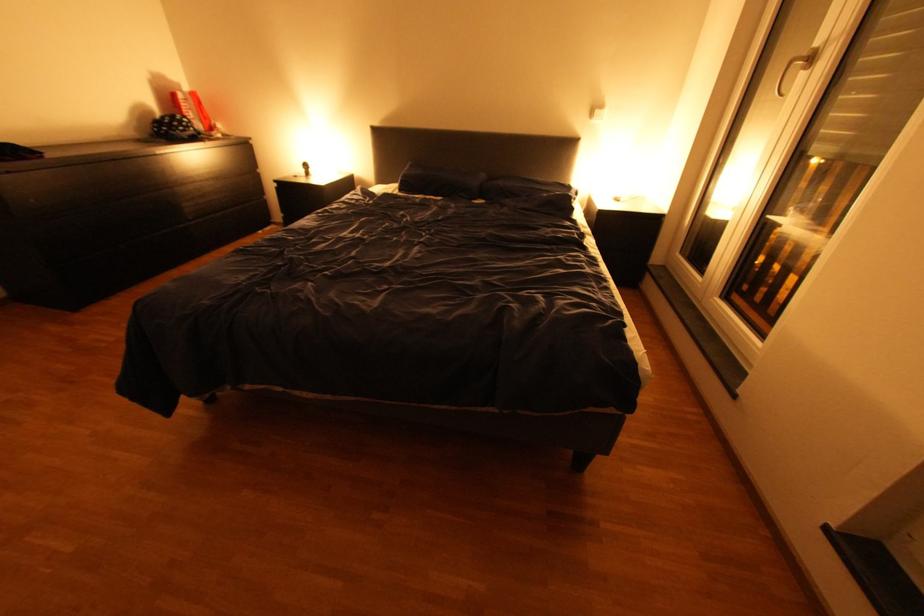
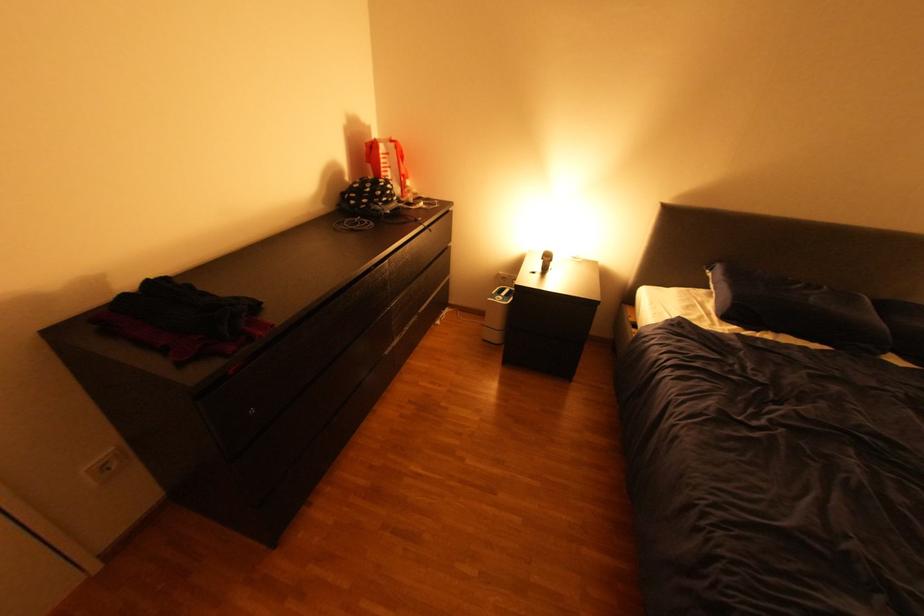
Locate, in the second image, the point that corresponds to the point at 320,169 in the first image.

(561, 262)